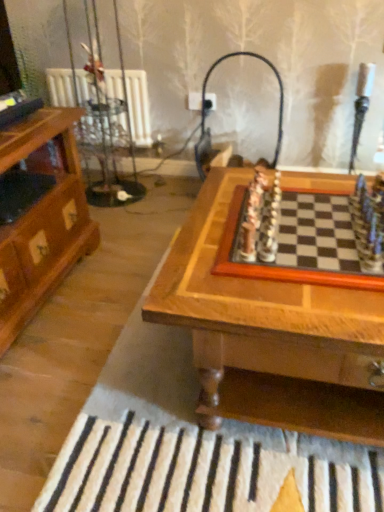
Question: Could wooden chessboard at center be considered to be inside matte black lamp at upper center?

Choices:
 (A) yes
 (B) no

Answer: (B)

Question: From a real-world perspective, is matte black lamp at upper center on wooden chessboard at center?

Choices:
 (A) yes
 (B) no

Answer: (A)

Question: Does matte black lamp at upper center have a lesser height compared to wooden chessboard at center?

Choices:
 (A) yes
 (B) no

Answer: (B)

Question: Considering the relative sizes of matte black lamp at upper center and wooden chessboard at center in the image provided, is matte black lamp at upper center taller than wooden chessboard at center?

Choices:
 (A) no
 (B) yes

Answer: (B)

Question: Does matte black lamp at upper center have a smaller size compared to wooden chessboard at center?

Choices:
 (A) yes
 (B) no

Answer: (A)

Question: Do you think wooden chessboard at center is within wooden chessboard at center, or outside of it?

Choices:
 (A) outside
 (B) inside

Answer: (B)

Question: From a real-world perspective, is wooden chessboard at center positioned above or below wooden chessboard at center?

Choices:
 (A) above
 (B) below

Answer: (A)

Question: From the image's perspective, is wooden chessboard at center above or below wooden chessboard at center?

Choices:
 (A) below
 (B) above

Answer: (B)

Question: Does point (321, 284) appear closer or farther from the camera than point (274, 330)?

Choices:
 (A) closer
 (B) farther

Answer: (B)

Question: Visually, is matte black lamp at upper center positioned to the left or to the right of wooden chessboard at center?

Choices:
 (A) left
 (B) right

Answer: (A)

Question: From the image's perspective, is matte black lamp at upper center above or below wooden chessboard at center?

Choices:
 (A) above
 (B) below

Answer: (A)

Question: Is matte black lamp at upper center wider or thinner than wooden chessboard at center?

Choices:
 (A) wide
 (B) thin

Answer: (B)

Question: Does point (203, 112) appear closer or farther from the camera than point (311, 309)?

Choices:
 (A) closer
 (B) farther

Answer: (B)

Question: In terms of height, does wooden chessboard at center look taller or shorter compared to matte black lamp at upper center?

Choices:
 (A) tall
 (B) short

Answer: (B)

Question: Is wooden chessboard at center inside or outside of matte black lamp at upper center?

Choices:
 (A) outside
 (B) inside

Answer: (A)